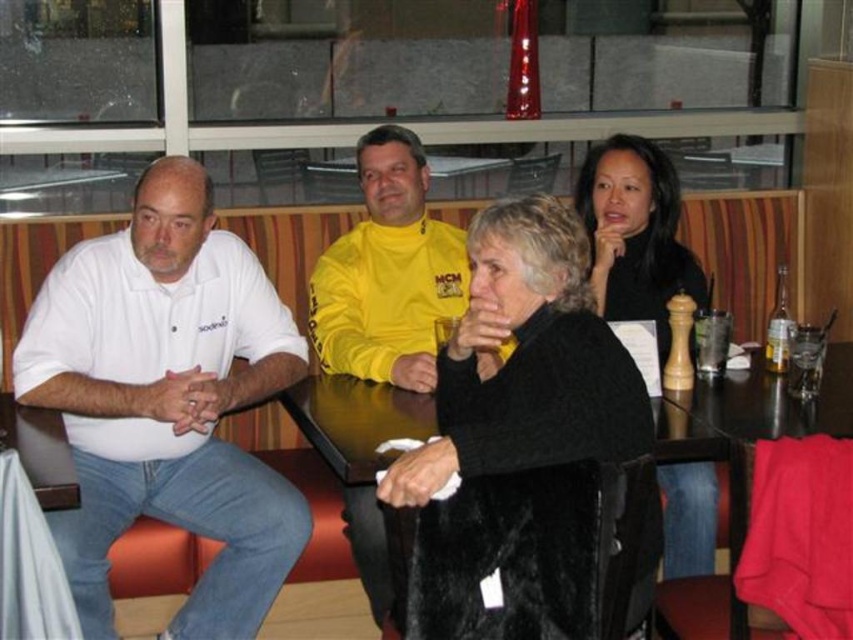
You are a photographer trying to capture a group photo of the people at the table. You need to ensure that the white cotton shirt at left and the black fuzzy coat at center are both clearly visible in the frame. Given their heights, which one might you need to adjust the camera angle for to ensure it doesn

The white cotton shirt at left is taller than the black fuzzy coat at center, so you might need to lower the camera angle slightly to ensure the black fuzzy coat at center is fully visible without being obscured by the taller white cotton shirt at left.

Please describe the location of the black fuzzy coat at center in the image using coordinates.

The black fuzzy coat at center is located at coordinates point (519,438).

Please look at the image and identify which object the point at coordinates [167,401] is located on. The available options are the white cotton shirt at left and the bright yellow long sleeve shirt with MCM written across the front.

The point at coordinates [167,401] is located on the white cotton shirt at left.